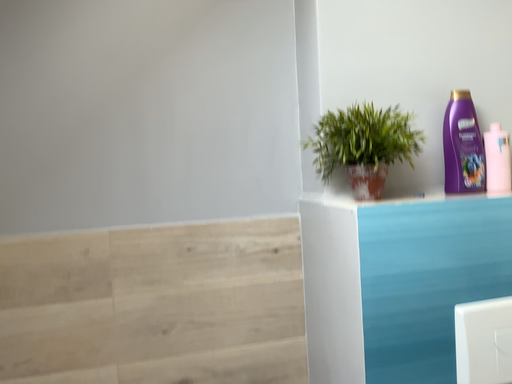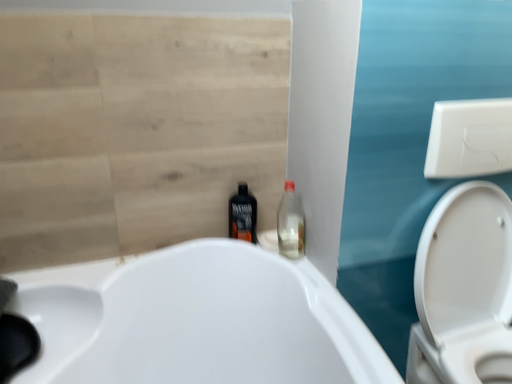
Question: Which way did the camera rotate in the video?

Choices:
 (A) rotated downward
 (B) rotated upward

Answer: (A)